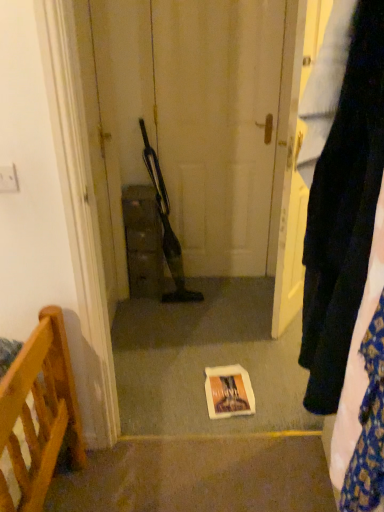
Question: Does white paper bag at center have a greater height compared to matte brown cabinet at center?

Choices:
 (A) no
 (B) yes

Answer: (A)

Question: Does white paper bag at center appear on the right side of matte brown cabinet at center?

Choices:
 (A) yes
 (B) no

Answer: (A)

Question: Is white paper bag at center shorter than matte brown cabinet at center?

Choices:
 (A) no
 (B) yes

Answer: (B)

Question: Is white paper bag at center thinner than matte brown cabinet at center?

Choices:
 (A) yes
 (B) no

Answer: (B)

Question: From a real-world perspective, does white paper bag at center sit lower than matte brown cabinet at center?

Choices:
 (A) no
 (B) yes

Answer: (B)

Question: Is white paper bag at center outside matte brown cabinet at center?

Choices:
 (A) no
 (B) yes

Answer: (B)

Question: Does matte brown cabinet at center appear on the right side of velvet dark blue pants at right?

Choices:
 (A) yes
 (B) no

Answer: (B)

Question: Is matte brown cabinet at center aimed at velvet dark blue pants at right?

Choices:
 (A) yes
 (B) no

Answer: (B)

Question: From a real-world perspective, is matte brown cabinet at center beneath velvet dark blue pants at right?

Choices:
 (A) no
 (B) yes

Answer: (B)

Question: Would you say matte brown cabinet at center contains velvet dark blue pants at right?

Choices:
 (A) no
 (B) yes

Answer: (A)

Question: Is matte brown cabinet at center facing away from velvet dark blue pants at right?

Choices:
 (A) yes
 (B) no

Answer: (B)

Question: Would you say matte brown cabinet at center is a long distance from velvet dark blue pants at right?

Choices:
 (A) yes
 (B) no

Answer: (A)

Question: From a real-world perspective, is matte brown cabinet at center under white paper bag at center?

Choices:
 (A) yes
 (B) no

Answer: (B)